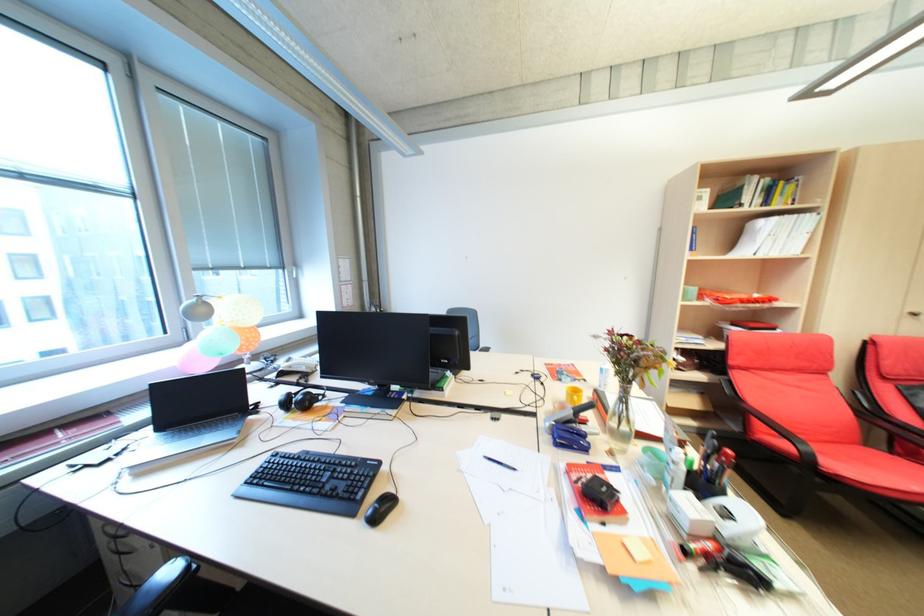
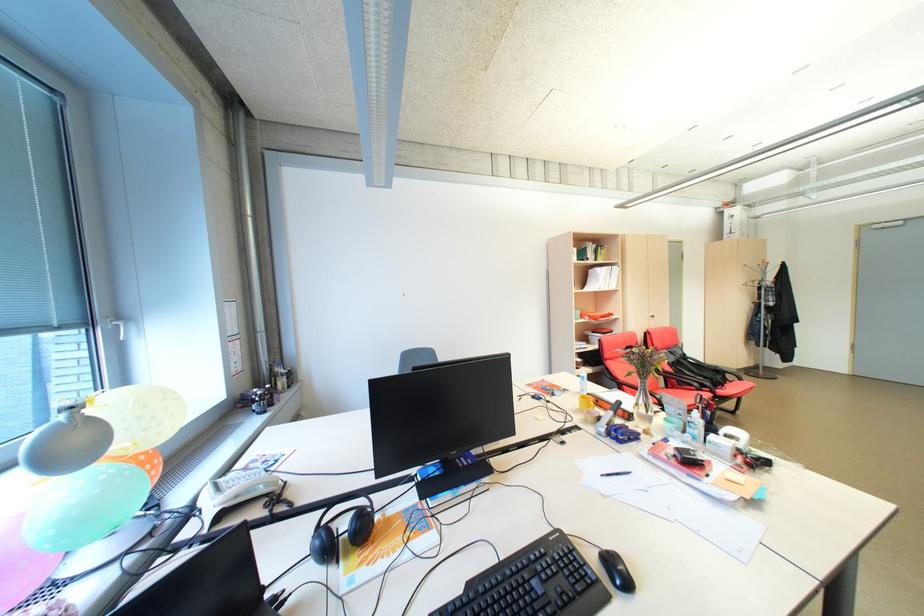
Find the pixel in the second image that matches point 361,399 in the first image.

(435, 488)